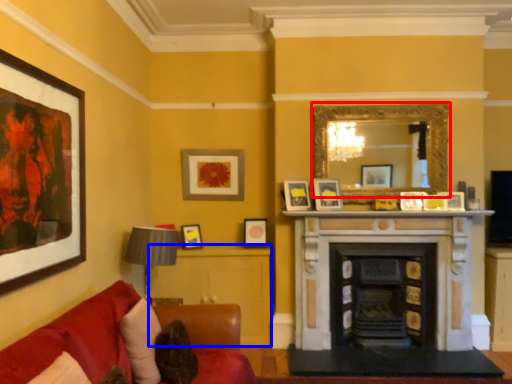
Question: Which object is further to the camera taking this photo, mirror (highlighted by a red box) or table (highlighted by a blue box)?

Choices:
 (A) mirror
 (B) table

Answer: (B)